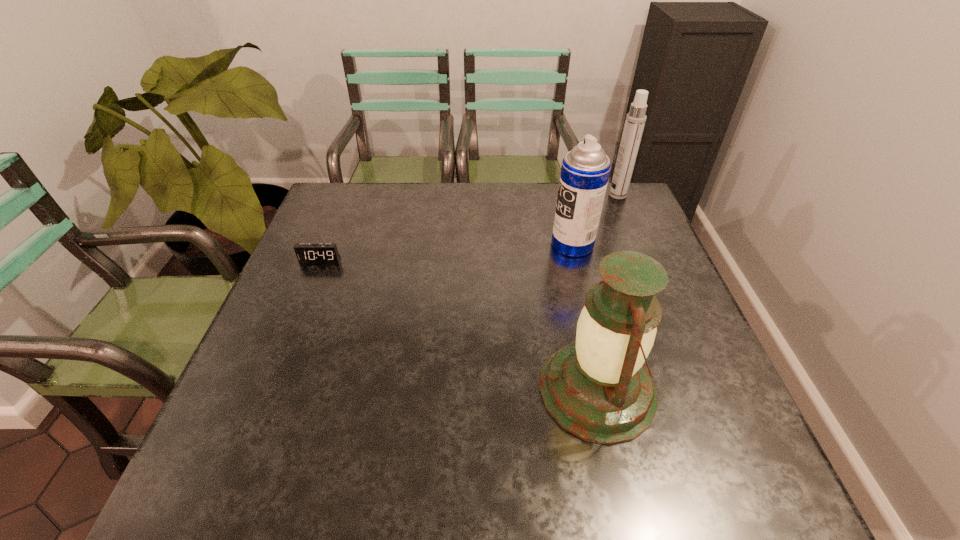
Locate an element on the screen. This screenshot has height=540, width=960. vacant space located 0.330m on the label side of the left aerosol can is located at coordinates (434, 244).

The width and height of the screenshot is (960, 540). Find the location of `free location located on the label side of the left aerosol can`. free location located on the label side of the left aerosol can is located at coordinates (494, 244).

You are a GUI agent. You are given a task and a screenshot of the screen. Output one action in this format:
    pyautogui.click(x=<x>, y=<y>)
    Task: Click on the free space located on the label side of the left aerosol can
    The height and width of the screenshot is (540, 960).
    Given the screenshot: What is the action you would take?
    pyautogui.click(x=526, y=244)

Image resolution: width=960 pixels, height=540 pixels. I want to click on free space located on the front-facing side of the alarm clock, so click(x=288, y=339).

This screenshot has width=960, height=540. I want to click on object at the far edge, so click(635, 120).

This screenshot has width=960, height=540. What are the coordinates of `object present at the left edge` in the screenshot? It's located at point(305,252).

You are a GUI agent. You are given a task and a screenshot of the screen. Output one action in this format:
    pyautogui.click(x=<x>, y=<y>)
    Task: Click on the aerosol can at the right edge
    
    Given the screenshot: What is the action you would take?
    pyautogui.click(x=635, y=120)

Locate an element on the screen. Image resolution: width=960 pixels, height=540 pixels. lantern that is at the right edge is located at coordinates (597, 388).

Where is `object that is at the far right corner`? object that is at the far right corner is located at coordinates (635, 120).

Where is `free space at the far edge of the desktop`? The height and width of the screenshot is (540, 960). free space at the far edge of the desktop is located at coordinates (502, 193).